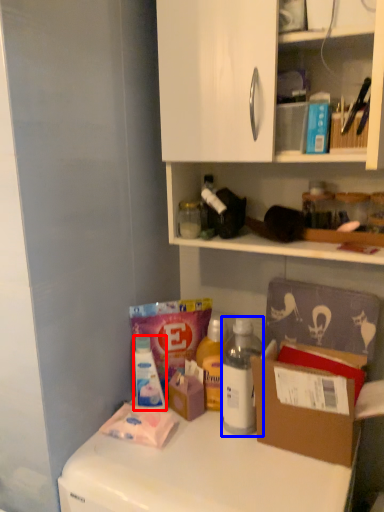
Question: Which point is closer to the camera, bottle (highlighted by a red box) or bottle (highlighted by a blue box)?

Choices:
 (A) bottle
 (B) bottle

Answer: (B)